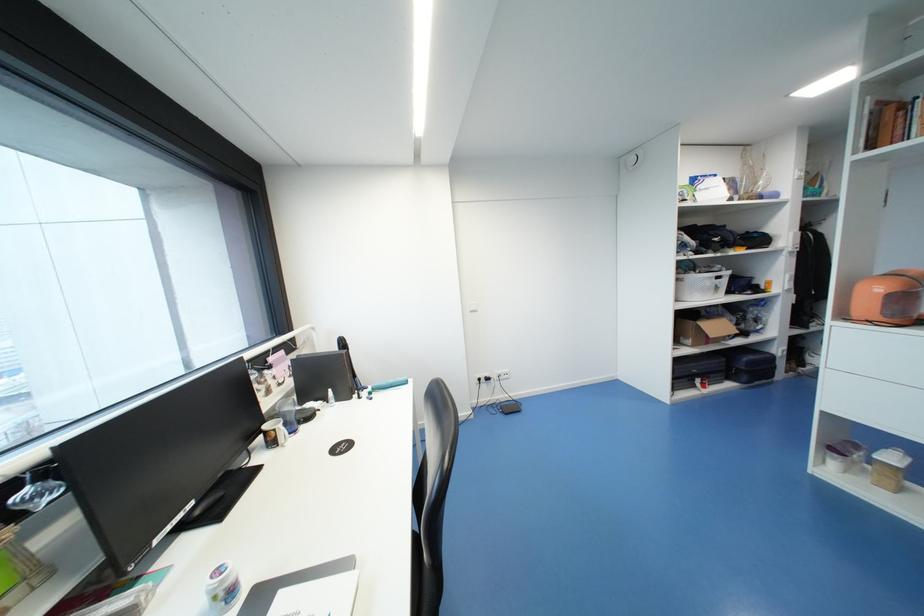
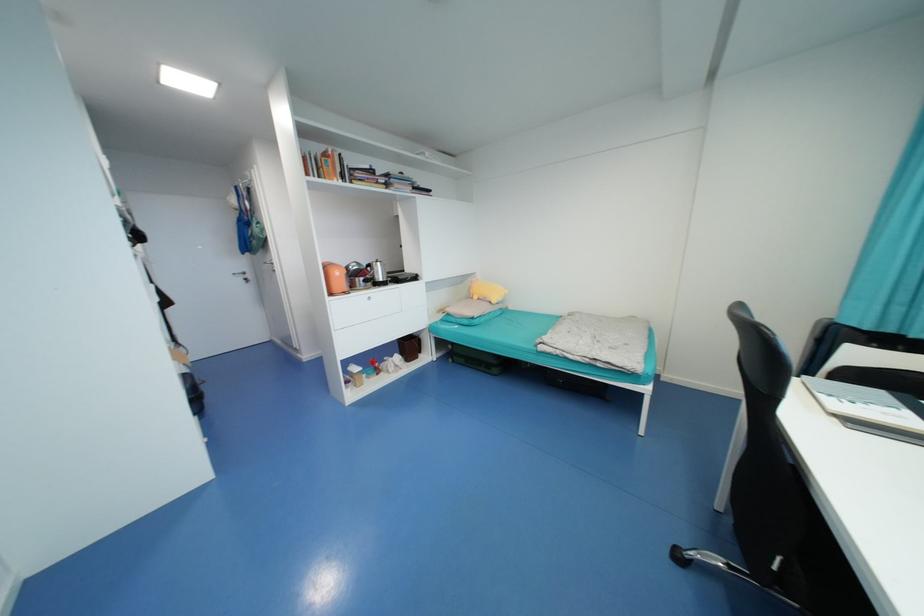
In the second image, find the point that corresponds to point (849, 318) in the first image.

(334, 294)